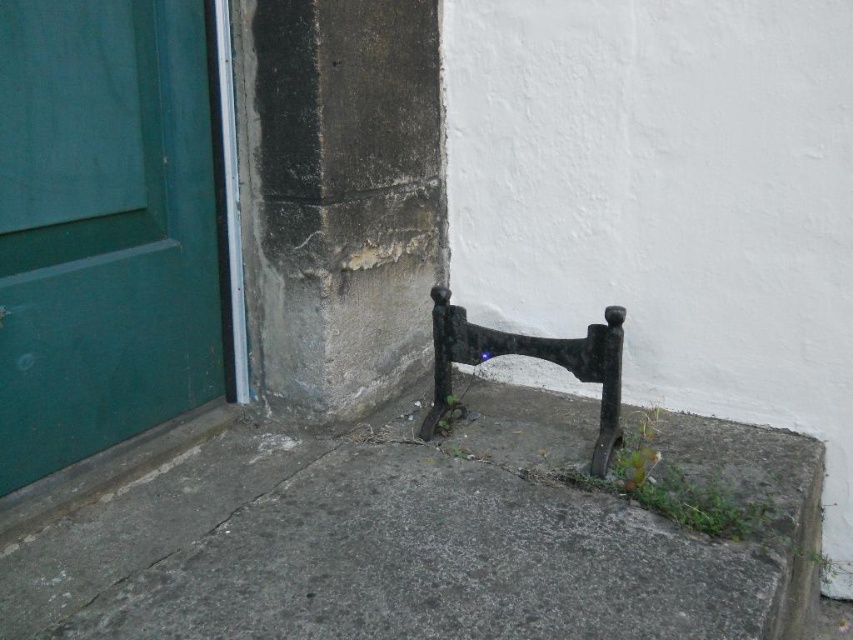
What do you see at coordinates (103, 227) in the screenshot? I see `green matte door at left` at bounding box center [103, 227].

Does point (114, 141) come farther from viewer compared to point (463, 346)?

No, it is in front of (463, 346).

Where is `green matte door at left`? green matte door at left is located at coordinates (103, 227).

Is point (141, 528) more distant than point (187, 324)?

No, it is not.

The height and width of the screenshot is (640, 853). Describe the element at coordinates (426, 538) in the screenshot. I see `gray concrete pavement at lower center` at that location.

Which is in front, point (509, 554) or point (45, 353)?

Positioned in front is point (509, 554).

The image size is (853, 640). What are the coordinates of `gray concrete pavement at lower center` in the screenshot? It's located at (426, 538).

Does gray concrete pavement at lower center have a smaller size compared to black wrought iron at lower right?

No.

Is point (422, 454) farther from camera compared to point (596, 356)?

Yes, it is.

Where is `gray concrete pavement at lower center`? The image size is (853, 640). gray concrete pavement at lower center is located at coordinates tap(426, 538).